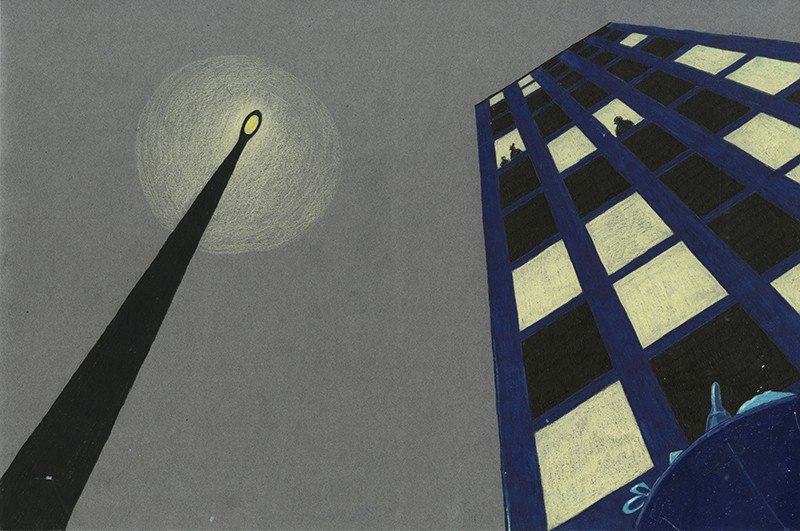
What are the coordinates of `light source` in the screenshot? It's located at (250, 122).